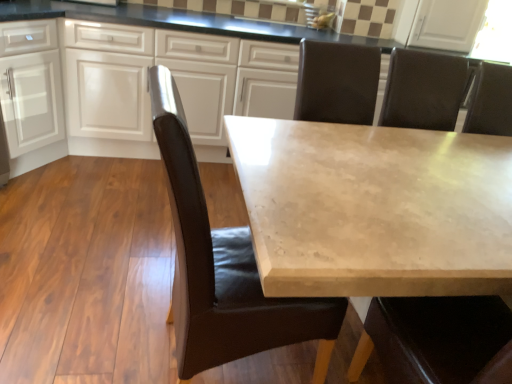
This screenshot has width=512, height=384. What are the coordinates of `free space that is to the left of brown leather chair at center` in the screenshot? It's located at (101, 321).